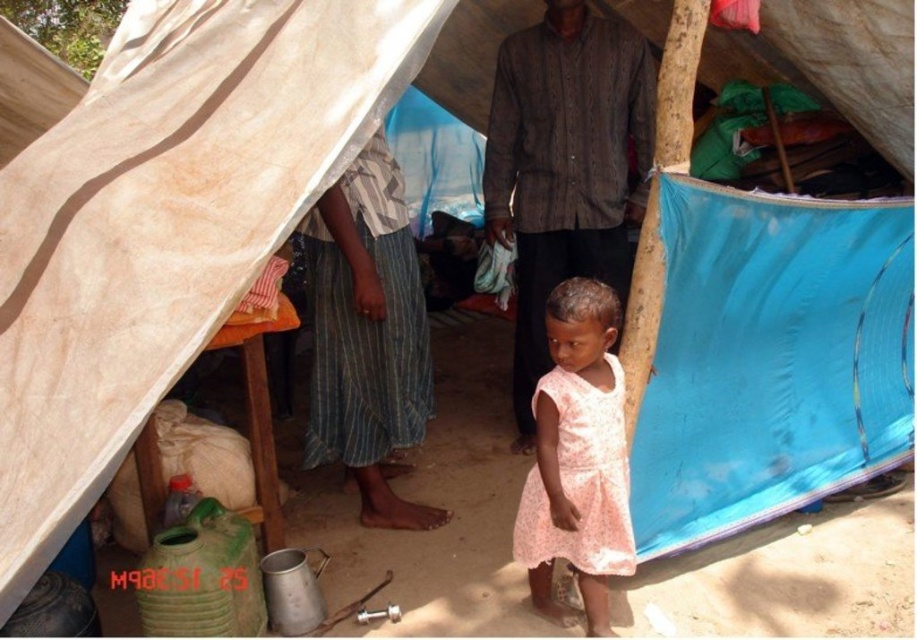
Can you confirm if textured brown shirt at center is positioned to the left of pink floral fabric dress at center?

In fact, textured brown shirt at center is to the right of pink floral fabric dress at center.

Does textured brown shirt at center have a lesser width compared to pink floral fabric dress at center?

No, textured brown shirt at center is not thinner than pink floral fabric dress at center.

Where is `textured brown shirt at center`? textured brown shirt at center is located at coordinates (565, 166).